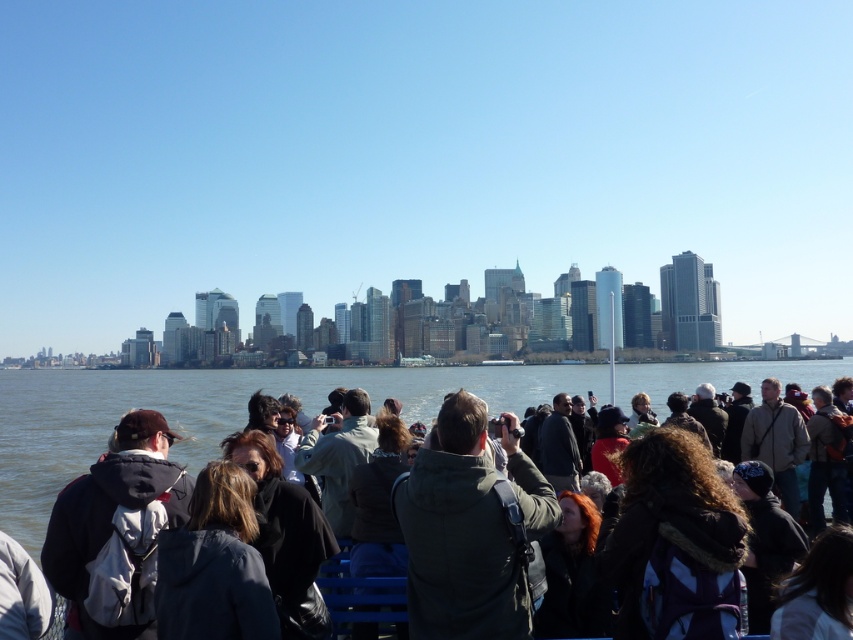
From the picture: You are a photographer trying to capture a group photo of the curly hair at center and dark red hair at center. Which person should you position closer to the camera to ensure both are in focus?

The curly hair at center is wider than dark red hair at center, so positioning the dark red hair at center closer to the camera will help keep both in focus.

You are a photographer trying to capture the city skyline in the background. You notice two people with curly hair at center and dark red hair at center are blocking your view. Which person should you move to avoid blocking the skyline?

You should move the curly hair at center because it is located above dark red hair at center, so moving the person with curly hair at center would provide a clearer view of the skyline.